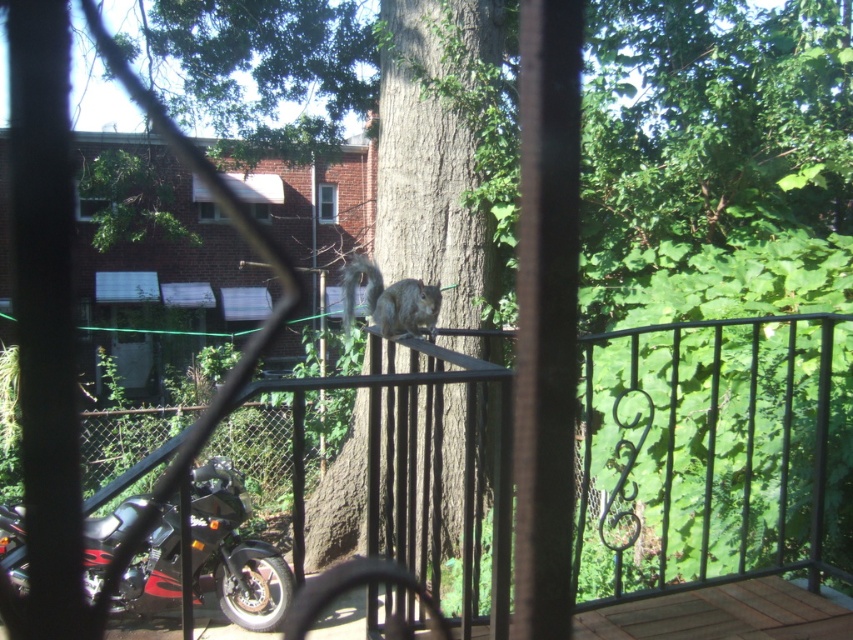
You are a delivery person who needs to park your motorcycle in a spot that is smaller than the black wrought iron fence at center. Can you park your black matte motorcycle at lower left in that spot?

The black wrought iron fence at center is bigger than the black matte motorcycle at lower left, so yes, the motorcycle can fit in a spot smaller than the fence.

You are standing at the center of the scene and want to move towards the black matte motorcycle at lower left. According to the spatial layout, which direction should you head to reach it?

The black matte motorcycle at lower left is located at point (234, 552), which is to the lower left direction from your current position at the center. You should head towards the lower left to reach it.